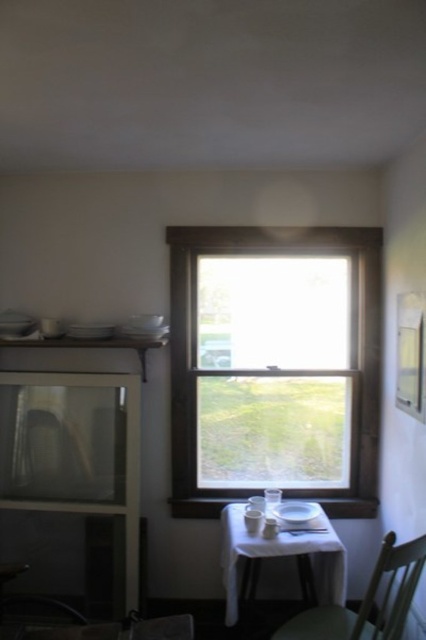
Question: Does brown wooden window at center come in front of white matte table at center?

Choices:
 (A) no
 (B) yes

Answer: (A)

Question: Does brown wooden window at center have a larger size compared to white matte table at center?

Choices:
 (A) no
 (B) yes

Answer: (B)

Question: Is brown wooden window at center further to the viewer compared to green matte chair at lower right?

Choices:
 (A) yes
 (B) no

Answer: (A)

Question: Which point appears farthest from the camera in this image?

Choices:
 (A) (221, 544)
 (B) (391, 588)
 (C) (221, 481)

Answer: (C)

Question: Which object is the farthest from the brown wooden window at center?

Choices:
 (A) white matte table at center
 (B) green matte chair at lower right

Answer: (B)

Question: Which object appears closest to the camera in this image?

Choices:
 (A) white matte table at center
 (B) green matte chair at lower right

Answer: (B)